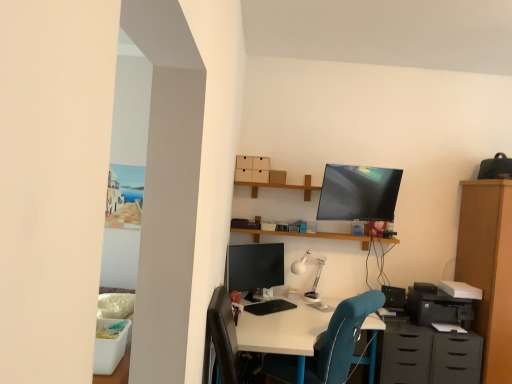
What do you see at coordinates (429, 356) in the screenshot? Image resolution: width=512 pixels, height=384 pixels. I see `matte black dresser at lower right` at bounding box center [429, 356].

Describe the element at coordinates (341, 339) in the screenshot. I see `teal fabric chair at center` at that location.

The image size is (512, 384). Find the location of `matte black monitor at center`. matte black monitor at center is located at coordinates (255, 266).

Consider the image. Between matte black dresser at lower right and teal fabric chair at center, which one appears on the left side from the viewer's perspective?

teal fabric chair at center.

Based on the photo, is matte black dresser at lower right positioned with its back to teal fabric chair at center?

No.

Is teal fabric chair at center surrounded by matte black dresser at lower right?

That's incorrect, teal fabric chair at center is not inside matte black dresser at lower right.

Is matte black dresser at lower right further to camera compared to teal fabric chair at center?

Yes, the depth of matte black dresser at lower right is greater than that of teal fabric chair at center.

From a real-world perspective, does black plastic printer at lower right sit lower than matte black dresser at lower right?

No.

Who is bigger, black plastic printer at lower right or matte black dresser at lower right?

Bigger between the two is matte black dresser at lower right.

Is black plastic printer at lower right positioned far away from matte black dresser at lower right?

black plastic printer at lower right is actually quite close to matte black dresser at lower right.

Which is correct: black plastic printer at lower right is inside matte black dresser at lower right, or outside of it?

black plastic printer at lower right is outside matte black dresser at lower right.

From the image's perspective, is wooden shelf at upper center under matte black dresser at lower right?

No.

Which is behind, wooden shelf at upper center or matte black dresser at lower right?

wooden shelf at upper center is further away from the camera.

Does point (253, 231) come in front of point (438, 335)?

No, (253, 231) is further to viewer.

Is wooden shelf at upper center bigger or smaller than matte black dresser at lower right?

Clearly, wooden shelf at upper center is smaller in size than matte black dresser at lower right.

Which object is closer to the camera taking this photo, black plastic printer at lower right or teal fabric chair at center?

teal fabric chair at center.

Which of these two, black plastic printer at lower right or teal fabric chair at center, is smaller?

With smaller size is black plastic printer at lower right.

Locate an element on the screen. This screenshot has width=512, height=384. printer that appears above the teal fabric chair at center (from the image's perspective) is located at coordinates (437, 306).

Would you say matte black monitor at center is to the left or to the right of black plastic printer at lower right in the picture?

From the image, it's evident that matte black monitor at center is to the left of black plastic printer at lower right.

Considering the relative sizes of matte black monitor at center and black plastic printer at lower right in the image provided, is matte black monitor at center thinner than black plastic printer at lower right?

Correct, the width of matte black monitor at center is less than that of black plastic printer at lower right.

Would you say matte black monitor at center is outside black plastic printer at lower right?

Yes, matte black monitor at center is outside of black plastic printer at lower right.

Consider the image. How much distance is there between matte black monitor at center and black plastic printer at lower right?

A distance of 4.09 feet exists between matte black monitor at center and black plastic printer at lower right.

From the image's perspective, does wooden shelf at upper center appear lower than black plastic printer at lower right?

No, from the image's perspective, wooden shelf at upper center is not below black plastic printer at lower right.

Is wooden shelf at upper center surrounding black plastic printer at lower right?

No.

From the picture: Is wooden shelf at upper center not near black plastic printer at lower right?

wooden shelf at upper center is actually quite close to black plastic printer at lower right.

How distant is wooden shelf at upper center from black plastic printer at lower right?

27.53 inches.

Which is nearer, [441,355] or [311,235]?

The point [441,355] is more forward.

How distant is matte black dresser at lower right from wooden shelf at upper center?

They are 99.93 centimeters apart.

Is the surface of matte black dresser at lower right in direct contact with wooden shelf at upper center?

matte black dresser at lower right and wooden shelf at upper center are clearly separated.

In the image, is matte black dresser at lower right positioned in front of or behind wooden shelf at upper center?

matte black dresser at lower right is in front of wooden shelf at upper center.

In the image, there is a teal fabric chair at center. Where is `dresser below it (from a real-world perspective)`? The width and height of the screenshot is (512, 384). dresser below it (from a real-world perspective) is located at coordinates (429, 356).

This screenshot has width=512, height=384. I want to click on printer behind the matte black dresser at lower right, so click(437, 306).

Looking at the image, which one is located further to matte black dresser at lower right, matte black monitor at center or black plastic printer at lower right?

matte black monitor at center is positioned further to the anchor matte black dresser at lower right.

From the image, which object appears to be farther from matte black monitor at center, black plastic printer at lower right or matte black dresser at lower right?

black plastic printer at lower right.

From the picture: When comparing their distances from matte black dresser at lower right, does teal fabric chair at center or wooden shelf at upper center seem further?

wooden shelf at upper center lies further to matte black dresser at lower right than the other object.

When comparing their distances from white matte desk lamp at center, does matte black dresser at lower right or matte black monitor at center seem further?

matte black dresser at lower right is further to white matte desk lamp at center.

Based on the photo, looking at the image, which one is located further to black plastic printer at lower right, wooden shelf at upper center or white matte desk lamp at center?

white matte desk lamp at center is further to black plastic printer at lower right.

From the image, which object appears to be nearer to matte black dresser at lower right, black plastic printer at lower right or wooden shelf at upper center?

Among the two, black plastic printer at lower right is located nearer to matte black dresser at lower right.

Based on the photo, which object lies nearer to the anchor point matte black dresser at lower right, white matte desk lamp at center or teal fabric chair at center?

teal fabric chair at center is positioned closer to the anchor matte black dresser at lower right.

Consider the image. From the image, which object appears to be farther from wooden shelf at upper center, teal fabric chair at center or white matte desk lamp at center?

The object further to wooden shelf at upper center is teal fabric chair at center.

Identify the location of shelf between teal fabric chair at center and matte black dresser at lower right. (305, 235).

You are a GUI agent. You are given a task and a screenshot of the screen. Output one action in this format:
    pyautogui.click(x=<x>, y=<y>)
    Task: Click on the printer situated between wooden shelf at upper center and matte black dresser at lower right from left to right
    The height and width of the screenshot is (384, 512).
    Given the screenshot: What is the action you would take?
    pyautogui.click(x=437, y=306)

Find the location of a particular element. The image size is (512, 384). shelf situated between white matte desk lamp at center and black plastic printer at lower right from left to right is located at coordinates (305, 235).

You are a GUI agent. You are given a task and a screenshot of the screen. Output one action in this format:
    pyautogui.click(x=<x>, y=<y>)
    Task: Click on the computer monitor positioned between teal fabric chair at center and wooden shelf at upper center from near to far
    
    Given the screenshot: What is the action you would take?
    pyautogui.click(x=255, y=266)